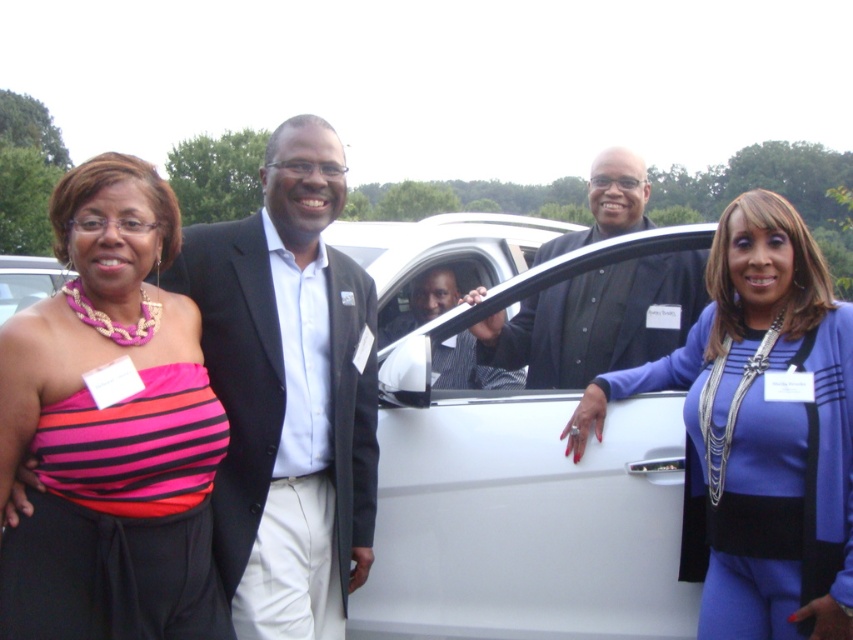
You are standing in front of the group of four people in the image. There are two points marked in the scene, one at coordinates point (782,621) and the other at point (630,218). Which point is closer to you?

Point (782,621) is closer to the viewer than point (630,218).

You are a photographer setting up for a group photo. You need to ensure that the blue satin dress at right and the black glossy suit at center are visible in the frame. Based on their heights, which one might need to stand on a platform to be seen better?

The blue satin dress at right is shorter than the black glossy suit at center, so the person in the blue satin dress at right might need to stand on a platform to be seen better.

You are a photographer at the event and need to capture a photo of both the white matte car at center and the blue satin dress at right without any obstruction. Based on their positions, which one should you focus on first to ensure both are in frame?

The white matte car at center is positioned over the blue satin dress at right, so you should focus on the blue satin dress at right first to ensure both are visible in the photo.